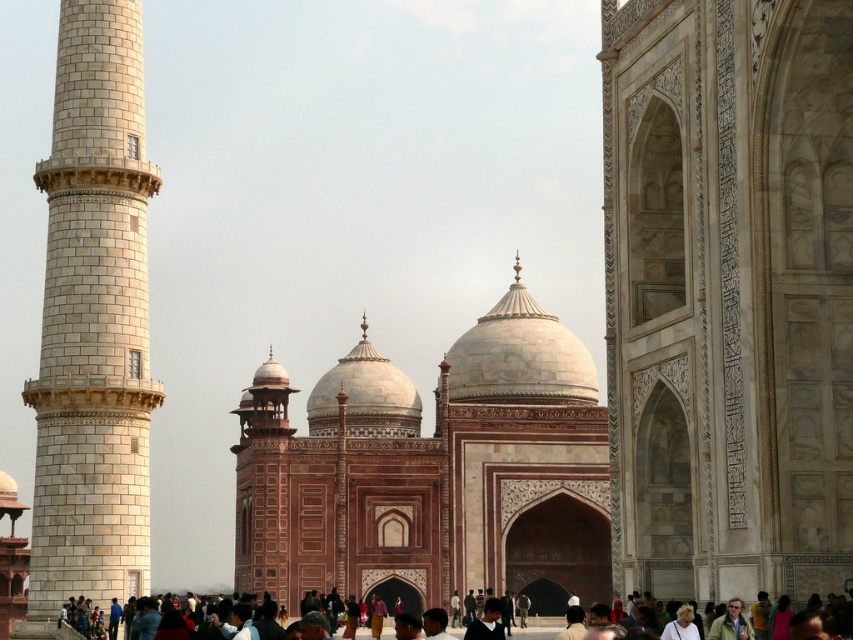
Question: Does white marble archway at right have a larger size compared to white marble tower at left?

Choices:
 (A) yes
 (B) no

Answer: (B)

Question: Can you confirm if white marble archway at right is bigger than white marble tower at left?

Choices:
 (A) no
 (B) yes

Answer: (A)

Question: Which of the following is the closest to the observer?

Choices:
 (A) (49, 317)
 (B) (668, 416)

Answer: (B)

Question: Does white marble archway at right appear on the right side of white marble tower at left?

Choices:
 (A) yes
 (B) no

Answer: (A)